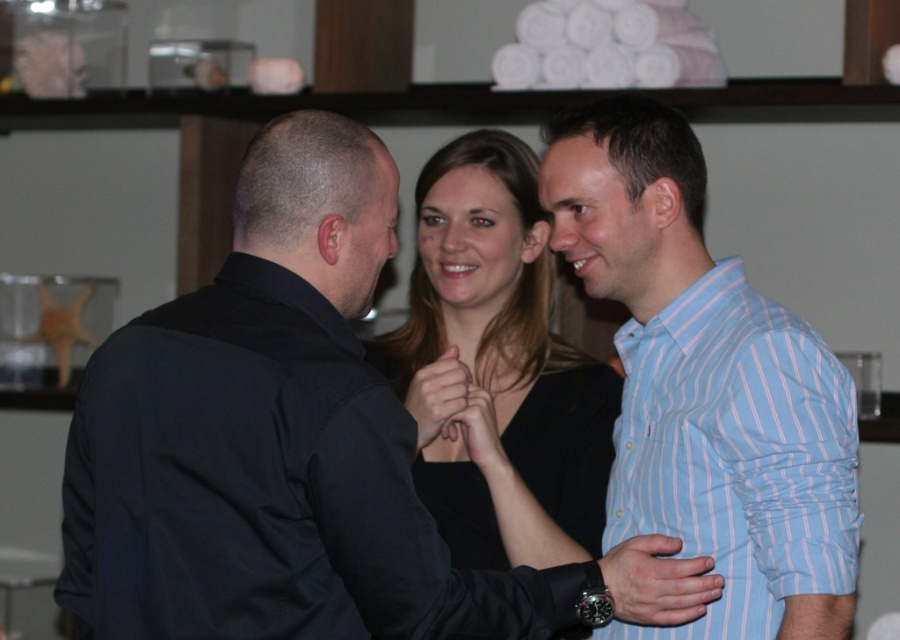
You are a photographer trying to capture a candid shot of the scene. You want to ensure that the smooth black dress at center and the smooth skin hand at center are both in focus. Since you can only focus on one object at a time, which one should you focus on to ensure the other is also in focus based on their positions?

The smooth black dress at center is to the right of smooth skin hand at center. Since they are positioned close to each other horizontally, focusing on either should keep both in focus due to their proximity.

You are a photographer setting up a shoot in this scene. You need to ensure that the smooth black dress at center and the smooth skin hand at center are both visible in the frame. Given that the dress is taller than the hand, which object should you position closer to the camera to ensure both are fully visible?

The smooth black dress at center is taller than the smooth skin hand at center. To ensure both are fully visible, position the smooth skin hand at center closer to the camera so that its height matches the dress in the frame.

You are standing at the center of the image and want to touch the point at coordinates (495,353). Which object will your finger land on?

The point at coordinates (495,353) is on the smooth black dress at center, so your finger will land on the smooth black dress at center.